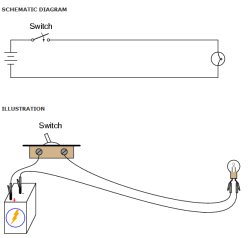
Where is `switch`? switch is located at coordinates (48, 139).